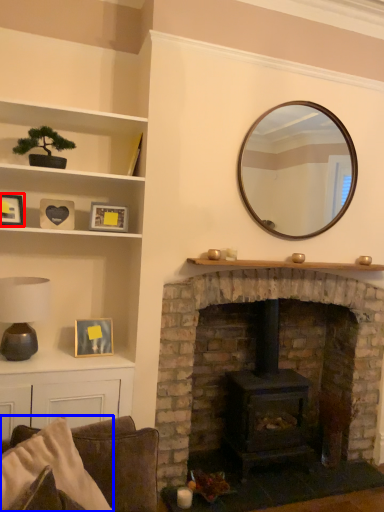
Question: Which object appears closest to the camera in this image, picture frame (highlighted by a red box) or pillow (highlighted by a blue box)?

Choices:
 (A) picture frame
 (B) pillow

Answer: (B)